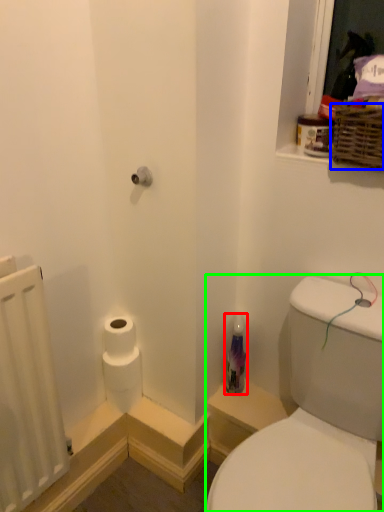
Question: Considering the real-world distances, which object is closest to toiletry (highlighted by a red box)? basket (highlighted by a blue box) or sink (highlighted by a green box).

Choices:
 (A) basket
 (B) sink

Answer: (B)